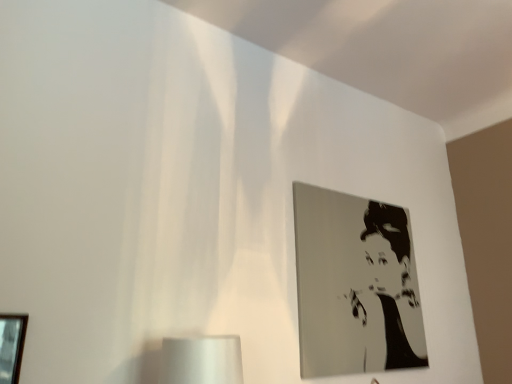
Locate an element on the screen. The image size is (512, 384). wooden picture frame at lower left, marked as the first picture frame in a left-to-right arrangement is located at coordinates (11, 346).

Describe the element at coordinates (11, 346) in the screenshot. I see `wooden picture frame at lower left, marked as the first picture frame in a left-to-right arrangement` at that location.

This screenshot has height=384, width=512. In order to click on metallic silver portrait at upper right, acting as the 2th picture frame starting from the left in this screenshot , I will do `click(355, 285)`.

What do you see at coordinates (355, 285) in the screenshot? I see `metallic silver portrait at upper right, the first picture frame positioned from the right` at bounding box center [355, 285].

This screenshot has height=384, width=512. Identify the location of wooden picture frame at lower left, acting as the second picture frame starting from the back. (11, 346).

Does wooden picture frame at lower left, the 2th picture frame viewed from the right, appear on the right side of metallic silver portrait at upper right, the first picture frame positioned from the right?

No, wooden picture frame at lower left, the 2th picture frame viewed from the right, is not to the right of metallic silver portrait at upper right, the first picture frame positioned from the right.

Which is behind, wooden picture frame at lower left, the first picture frame viewed from the front, or metallic silver portrait at upper right, placed as the second picture frame when sorted from front to back?

Positioned behind is metallic silver portrait at upper right, placed as the second picture frame when sorted from front to back.

Considering the positions of points (13, 314) and (353, 357), is point (13, 314) closer to camera compared to point (353, 357)?

Yes, point (13, 314) is closer to viewer.

From the image's perspective, would you say wooden picture frame at lower left, the first picture frame viewed from the front, is positioned over metallic silver portrait at upper right, the first picture frame positioned from the right?

No, from the image's perspective, wooden picture frame at lower left, the first picture frame viewed from the front, is not over metallic silver portrait at upper right, the first picture frame positioned from the right.

From a real-world perspective, which object rests below the other?

In real-world perspective, wooden picture frame at lower left, acting as the second picture frame starting from the back, is lower.

Is wooden picture frame at lower left, acting as the second picture frame starting from the back, wider than metallic silver portrait at upper right, the first picture frame positioned from the right?

Incorrect, the width of wooden picture frame at lower left, acting as the second picture frame starting from the back, does not surpass that of metallic silver portrait at upper right, the first picture frame positioned from the right.

Considering the sizes of objects wooden picture frame at lower left, marked as the first picture frame in a left-to-right arrangement, and metallic silver portrait at upper right, the first picture frame positioned from the right, in the image provided, who is taller, wooden picture frame at lower left, marked as the first picture frame in a left-to-right arrangement, or metallic silver portrait at upper right, the first picture frame positioned from the right,?

Standing taller between the two is metallic silver portrait at upper right, the first picture frame positioned from the right.

Considering the sizes of objects wooden picture frame at lower left, the first picture frame viewed from the front, and metallic silver portrait at upper right, the first picture frame positioned from the right, in the image provided, who is smaller, wooden picture frame at lower left, the first picture frame viewed from the front, or metallic silver portrait at upper right, the first picture frame positioned from the right,?

wooden picture frame at lower left, the first picture frame viewed from the front, is smaller.

Can we say wooden picture frame at lower left, the 2th picture frame viewed from the right, lies outside metallic silver portrait at upper right, placed as the second picture frame when sorted from front to back?

Yes.

Are wooden picture frame at lower left, acting as the second picture frame starting from the back, and metallic silver portrait at upper right, placed as the second picture frame when sorted from front to back, located far from each other?

That's right, there is a large distance between wooden picture frame at lower left, acting as the second picture frame starting from the back, and metallic silver portrait at upper right, placed as the second picture frame when sorted from front to back.

Consider the image. Is metallic silver portrait at upper right, acting as the 2th picture frame starting from the left, at the back of wooden picture frame at lower left, marked as the first picture frame in a left-to-right arrangement?

wooden picture frame at lower left, marked as the first picture frame in a left-to-right arrangement, is not turned away from metallic silver portrait at upper right, acting as the 2th picture frame starting from the left.

How distant is wooden picture frame at lower left, acting as the second picture frame starting from the back, from metallic silver portrait at upper right, placed as the second picture frame when sorted from front to back?

4.84 feet.

In the image, there is a wooden picture frame at lower left, the 2th picture frame viewed from the right. Identify the location of picture frame above it (from the image's perspective). (355, 285).

Looking at this image, considering the relative positions of metallic silver portrait at upper right, the first picture frame positioned from the right, and wooden picture frame at lower left, the first picture frame viewed from the front, in the image provided, is metallic silver portrait at upper right, the first picture frame positioned from the right, to the left of wooden picture frame at lower left, the first picture frame viewed from the front, from the viewer's perspective?

No, metallic silver portrait at upper right, the first picture frame positioned from the right, is not to the left of wooden picture frame at lower left, the first picture frame viewed from the front.

Is the position of metallic silver portrait at upper right, arranged as the 1th picture frame when viewed from the back, more distant than that of wooden picture frame at lower left, marked as the first picture frame in a left-to-right arrangement?

Yes, the depth of metallic silver portrait at upper right, arranged as the 1th picture frame when viewed from the back, is greater than that of wooden picture frame at lower left, marked as the first picture frame in a left-to-right arrangement.

Does point (362, 235) appear closer or farther from the camera than point (20, 328)?

Point (362, 235) appears to be farther away from the viewer than point (20, 328).

From the image's perspective, is metallic silver portrait at upper right, arranged as the 1th picture frame when viewed from the back, beneath wooden picture frame at lower left, acting as the second picture frame starting from the back?

No, from the image's perspective, metallic silver portrait at upper right, arranged as the 1th picture frame when viewed from the back, is not beneath wooden picture frame at lower left, acting as the second picture frame starting from the back.

Based on the photo, from a real-world perspective, is metallic silver portrait at upper right, placed as the second picture frame when sorted from front to back, above or below wooden picture frame at lower left, marked as the first picture frame in a left-to-right arrangement?

metallic silver portrait at upper right, placed as the second picture frame when sorted from front to back, is above wooden picture frame at lower left, marked as the first picture frame in a left-to-right arrangement.

In terms of width, does metallic silver portrait at upper right, acting as the 2th picture frame starting from the left, look wider or thinner when compared to wooden picture frame at lower left, acting as the second picture frame starting from the back?

Clearly, metallic silver portrait at upper right, acting as the 2th picture frame starting from the left, has more width compared to wooden picture frame at lower left, acting as the second picture frame starting from the back.

Considering the relative sizes of metallic silver portrait at upper right, acting as the 2th picture frame starting from the left, and wooden picture frame at lower left, marked as the first picture frame in a left-to-right arrangement, in the image provided, is metallic silver portrait at upper right, acting as the 2th picture frame starting from the left, taller than wooden picture frame at lower left, marked as the first picture frame in a left-to-right arrangement,?

Yes, metallic silver portrait at upper right, acting as the 2th picture frame starting from the left, is taller than wooden picture frame at lower left, marked as the first picture frame in a left-to-right arrangement.

Considering the sizes of objects metallic silver portrait at upper right, acting as the 2th picture frame starting from the left, and wooden picture frame at lower left, marked as the first picture frame in a left-to-right arrangement, in the image provided, who is smaller, metallic silver portrait at upper right, acting as the 2th picture frame starting from the left, or wooden picture frame at lower left, marked as the first picture frame in a left-to-right arrangement,?

Smaller between the two is wooden picture frame at lower left, marked as the first picture frame in a left-to-right arrangement.

Is metallic silver portrait at upper right, the first picture frame positioned from the right, located outside wooden picture frame at lower left, marked as the first picture frame in a left-to-right arrangement?

Indeed, metallic silver portrait at upper right, the first picture frame positioned from the right, is completely outside wooden picture frame at lower left, marked as the first picture frame in a left-to-right arrangement.

Does metallic silver portrait at upper right, acting as the 2th picture frame starting from the left, touch wooden picture frame at lower left, acting as the second picture frame starting from the back?

No, metallic silver portrait at upper right, acting as the 2th picture frame starting from the left, is not next to wooden picture frame at lower left, acting as the second picture frame starting from the back.

Based on the photo, could you tell me if metallic silver portrait at upper right, arranged as the 1th picture frame when viewed from the back, is facing wooden picture frame at lower left, acting as the second picture frame starting from the back?

No, metallic silver portrait at upper right, arranged as the 1th picture frame when viewed from the back, is not oriented towards wooden picture frame at lower left, acting as the second picture frame starting from the back.

This screenshot has width=512, height=384. Identify the location of picture frame behind the wooden picture frame at lower left, the 2th picture frame viewed from the right. (355, 285).

The width and height of the screenshot is (512, 384). I want to click on picture frame above the wooden picture frame at lower left, acting as the second picture frame starting from the back (from a real-world perspective), so click(x=355, y=285).

Locate an element on the screen. picture frame above the wooden picture frame at lower left, acting as the second picture frame starting from the back (from the image's perspective) is located at coordinates (355, 285).